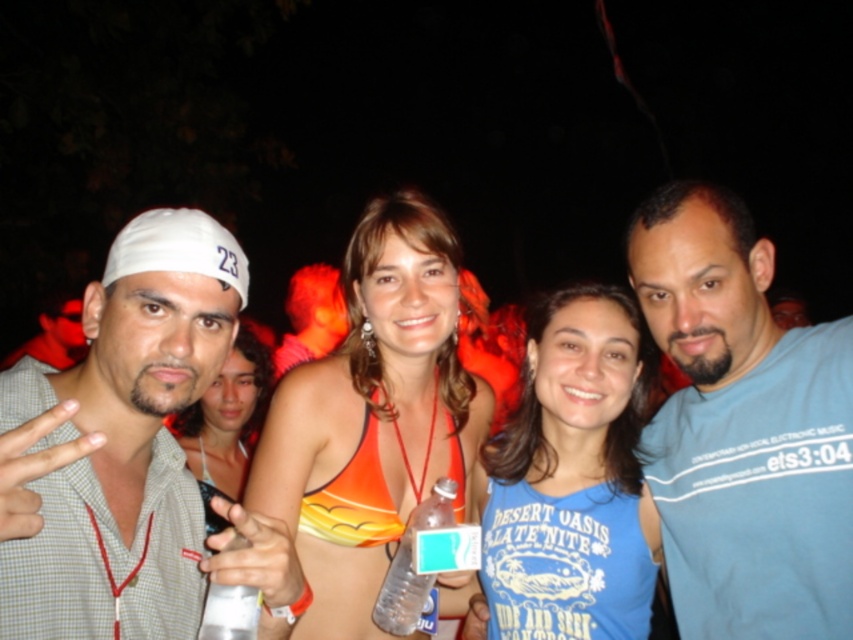
You are a photographer trying to capture a clear shot of the white fabric cap at left and the white plastic cup at lower left. Which object should you focus on first if you want to ensure both are in focus?

The white fabric cap at left is in front of the white plastic cup at lower left, so you should focus on the white fabric cap at left first to ensure both are in focus.

You are at a party and need to pour a drink into a container. You have the clear plastic bottle at center and the white plastic cup at lower left. Which container can hold more liquid based on their sizes?

The clear plastic bottle at center has a greater height compared to the white plastic cup at lower left, so it can hold more liquid.